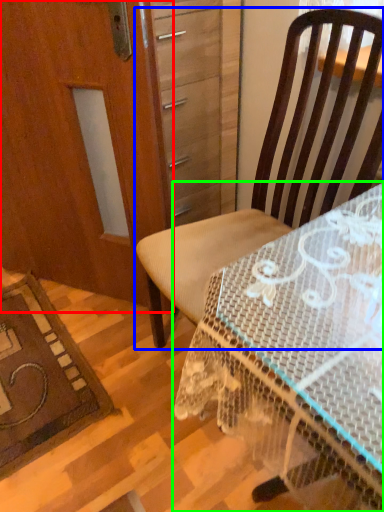
Question: Considering the real-world distances, which object is farthest from screen door (highlighted by a red box)? chair (highlighted by a blue box) or desk (highlighted by a green box)?

Choices:
 (A) chair
 (B) desk

Answer: (B)